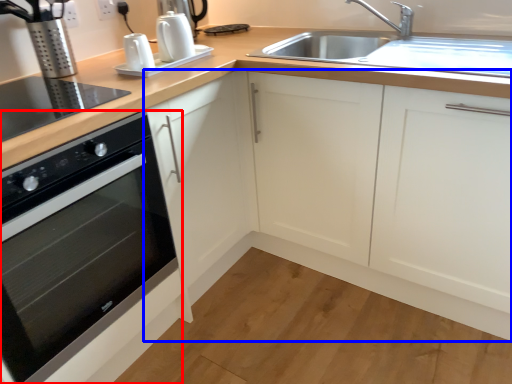
Question: Which object appears farthest to the camera in this image, home appliance (highlighted by a red box) or cabinetry (highlighted by a blue box)?

Choices:
 (A) home appliance
 (B) cabinetry

Answer: (B)